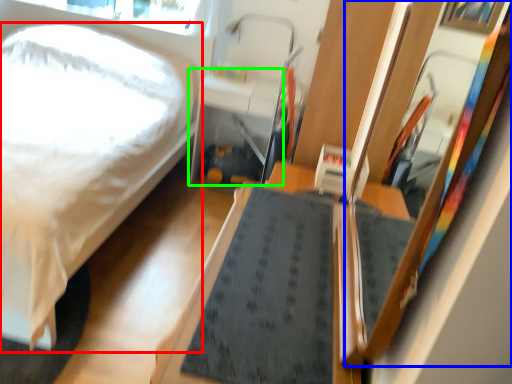
Question: Based on their relative distances, which object is farther from bed (highlighted by a red box)? Choose from mirror (highlighted by a blue box) and table (highlighted by a green box).

Choices:
 (A) mirror
 (B) table

Answer: (A)